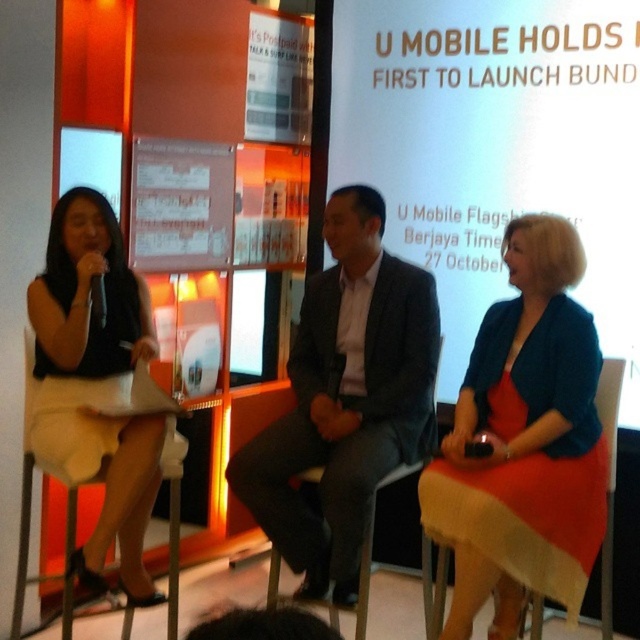
Who is more forward, (x=385, y=74) or (x=74, y=410)?

Result: Point (x=74, y=410) is more forward.

Does white matte projection screen at center appear under matte black dress at left?

No.

Who is more forward, (x=500, y=220) or (x=104, y=294)?

Point (x=104, y=294) is in front.

Image resolution: width=640 pixels, height=640 pixels. I want to click on white matte projection screen at center, so click(x=497, y=147).

Is matte blue dress at center below dark gray suit at center?

Yes, matte blue dress at center is below dark gray suit at center.

Find the location of a particular element. matte blue dress at center is located at coordinates point(524,442).

I want to click on matte blue dress at center, so click(x=524, y=442).

Is point (416, 355) farther from viewer compared to point (115, 372)?

Yes.

Between point (349, 552) and point (147, 458), which one is positioned behind?

Point (349, 552)

This screenshot has width=640, height=640. What are the coordinates of `dark gray suit at center` in the screenshot? It's located at (344, 400).